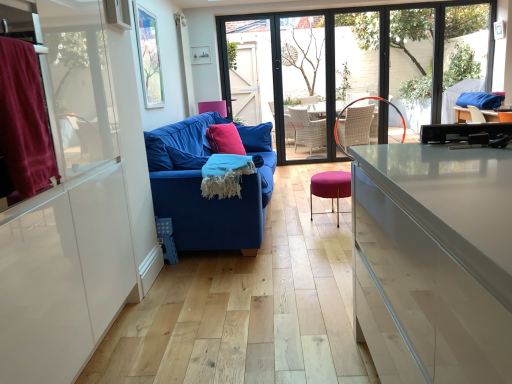
Image resolution: width=512 pixels, height=384 pixels. In order to click on velvet burgundy curtain at left in this screenshot , I will do `click(24, 122)`.

What do you see at coordinates (303, 86) in the screenshot? I see `transparent glass screen door at center` at bounding box center [303, 86].

What is the approximate height of transparent glass screen door at center?

2.04 meters.

Where is `transparent glass window at center`? This screenshot has width=512, height=384. transparent glass window at center is located at coordinates (411, 55).

Identify the location of transparent glass door at center. (364, 64).

Image resolution: width=512 pixels, height=384 pixels. What are the coordinates of `blue fabric couch at center` in the screenshot? It's located at (200, 185).

The image size is (512, 384). Find the location of `velvet burgundy curtain at left`. velvet burgundy curtain at left is located at coordinates (24, 122).

Consider the image. From a real-world perspective, does velvet burgundy curtain at left sit lower than blue fabric couch at center?

Actually, velvet burgundy curtain at left is physically above blue fabric couch at center in the real world.

Is velvet burgundy curtain at left beside blue fabric couch at center?

No, velvet burgundy curtain at left is not in contact with blue fabric couch at center.

This screenshot has width=512, height=384. In the image, there is a velvet burgundy curtain at left. In order to click on studio couch above it (from the image's perspective) in this screenshot , I will do `click(200, 185)`.

From the picture: Which of these two, velvet burgundy curtain at left or blue fabric couch at center, is bigger?

Bigger between the two is blue fabric couch at center.

From the image's perspective, does velvet burgundy curtain at left appear higher than transparent glass door at center?

No, from the image's perspective, velvet burgundy curtain at left is not over transparent glass door at center.

Looking at this image, is velvet burgundy curtain at left aimed at transparent glass door at center?

No, velvet burgundy curtain at left is not oriented towards transparent glass door at center.

Would you consider velvet burgundy curtain at left to be distant from transparent glass door at center?

Yes.

Considering the relative sizes of velvet burgundy curtain at left and transparent glass door at center in the image provided, is velvet burgundy curtain at left shorter than transparent glass door at center?

Yes.

Between point (415, 62) and point (215, 178), which one is positioned in front?

The point (215, 178) is closer.

Which is more to the left, transparent glass door at center or blue woven blanket at center?

blue woven blanket at center is more to the left.

Which object is further away from the camera taking this photo, transparent glass door at center or blue woven blanket at center?

transparent glass door at center is further from the camera.

Who is taller, transparent glass door at center or velvet burgundy curtain at left, marked as the second window screen in a back-to-front arrangement?

Standing taller between the two is transparent glass door at center.

Is transparent glass door at center at the right side of velvet burgundy curtain at left, which is counted as the first window screen, starting from the bottom?

Indeed, transparent glass door at center is positioned on the right side of velvet burgundy curtain at left, which is counted as the first window screen, starting from the bottom.

Is velvet burgundy curtain at left, positioned as the second window screen in top-to-bottom order, inside transparent glass door at center?

Definitely not — velvet burgundy curtain at left, positioned as the second window screen in top-to-bottom order, is not inside transparent glass door at center.

Considering the relative sizes of transparent glass door at center and velvet burgundy curtain at left, which is counted as the first window screen, starting from the bottom, in the image provided, is transparent glass door at center smaller than velvet burgundy curtain at left, which is counted as the first window screen, starting from the bottom,?

No.

Who is smaller, velvet burgundy curtain at left, marked as the second window screen in a back-to-front arrangement, or transparent glass door at center?

velvet burgundy curtain at left, marked as the second window screen in a back-to-front arrangement, is smaller.

Is point (99, 148) positioned before point (321, 117)?

Yes, point (99, 148) is in front of point (321, 117).

From a real-world perspective, is velvet burgundy curtain at left, marked as the second window screen in a back-to-front arrangement, over transparent glass door at center?

Yes, from a real-world perspective, velvet burgundy curtain at left, marked as the second window screen in a back-to-front arrangement, is on top of transparent glass door at center.

Is velvet burgundy curtain at left, marked as the second window screen in a back-to-front arrangement, completely or partially outside of transparent glass door at center?

Yes, velvet burgundy curtain at left, marked as the second window screen in a back-to-front arrangement, is located beyond the bounds of transparent glass door at center.

Is the depth of transparent glass window at center less than that of velvet burgundy curtain at left, which is counted as the first window screen, starting from the bottom?

That is False.

Considering the points (394, 18) and (60, 81), which point is in front, point (394, 18) or point (60, 81)?

The point (60, 81) is more forward.

Can you tell me how much transparent glass window at center and velvet burgundy curtain at left, marked as the second window screen in a back-to-front arrangement, differ in facing direction?

transparent glass window at center and velvet burgundy curtain at left, marked as the second window screen in a back-to-front arrangement, are facing 86.9 degrees away from each other.

Does transparent glass door at center touch transparent glass window screen at upper center, which is counted as the 2th window screen, starting from the front?

There is a gap between transparent glass door at center and transparent glass window screen at upper center, which is counted as the 2th window screen, starting from the front.

From a real-world perspective, between transparent glass door at center and transparent glass window screen at upper center, the second window screen when ordered from bottom to top, who is vertically lower?

In real-world perspective, transparent glass door at center is lower.

Which point is more distant from viewer, (360, 27) or (148, 34)?

Positioned behind is point (360, 27).

Is transparent glass door at center further to camera compared to transparent glass window screen at upper center, placed as the 1th window screen when sorted from top to bottom?

Yes.

Identify the location of studio couch on the right of the velvet burgundy curtain at left. This screenshot has height=384, width=512. (200, 185).

At what (x,y) coordinates should I click in order to perform the action: click on glass door above the velvet burgundy curtain at left (from the image's perspective). Please return your answer as a coordinate pair (x, y). This screenshot has height=384, width=512. Looking at the image, I should click on (364, 64).

Considering their positions, is blue woven blanket at center positioned closer to transparent glass window screen at upper center, which is counted as the 1th window screen, starting from the back, than velvet burgundy curtain at left, marked as the second window screen in a back-to-front arrangement?

blue woven blanket at center.

When comparing their distances from transparent glass window at center, does pink fabric pillow at center or blue woven blanket at center seem further?

blue woven blanket at center is further to transparent glass window at center.

In the scene shown: Estimate the real-world distances between objects in this image. Which object is further from velvet burgundy curtain at left, which is counted as the first window screen, starting from the bottom, pink fabric pillow at center or blue fabric couch at center?

pink fabric pillow at center is positioned further to the anchor velvet burgundy curtain at left, which is counted as the first window screen, starting from the bottom.

Estimate the real-world distances between objects in this image. Which object is closer to velvet burgundy curtain at left, pink fabric pillow at center or transparent glass screen door at center?

pink fabric pillow at center lies closer to velvet burgundy curtain at left than the other object.

Considering their positions, is blue fabric couch at center positioned closer to blue woven blanket at center than transparent glass screen door at center?

blue fabric couch at center is closer to blue woven blanket at center.

Considering their positions, is transparent glass window at center positioned closer to purple fabric stool at center than transparent glass door at center?

transparent glass window at center.

Which object lies nearer to the anchor point velvet burgundy curtain at left, pink fabric pillow at center or blue fabric couch at center?

blue fabric couch at center lies closer to velvet burgundy curtain at left than the other object.

Considering their positions, is blue fabric couch at center positioned closer to velvet burgundy curtain at left than transparent glass window screen at upper center, which is counted as the 1th window screen, starting from the back?

blue fabric couch at center is positioned closer to the anchor velvet burgundy curtain at left.

The width and height of the screenshot is (512, 384). Identify the location of material between velvet burgundy curtain at left and transparent glass screen door at center from front to back. (225, 175).

Find the location of a particular element. bar stool between blue woven blanket at center and transparent glass window at center along the z-axis is located at coordinates (330, 188).

Find the location of a particular element. The image size is (512, 384). studio couch located between velvet burgundy curtain at left and transparent glass screen door at center in the depth direction is located at coordinates (200, 185).

At what (x,y) coordinates should I click in order to perform the action: click on material located between velvet burgundy curtain at left, positioned as the second window screen in top-to-bottom order, and pink fabric pillow at center in the depth direction. Please return your answer as a coordinate pair (x, y). Looking at the image, I should click on (225, 175).